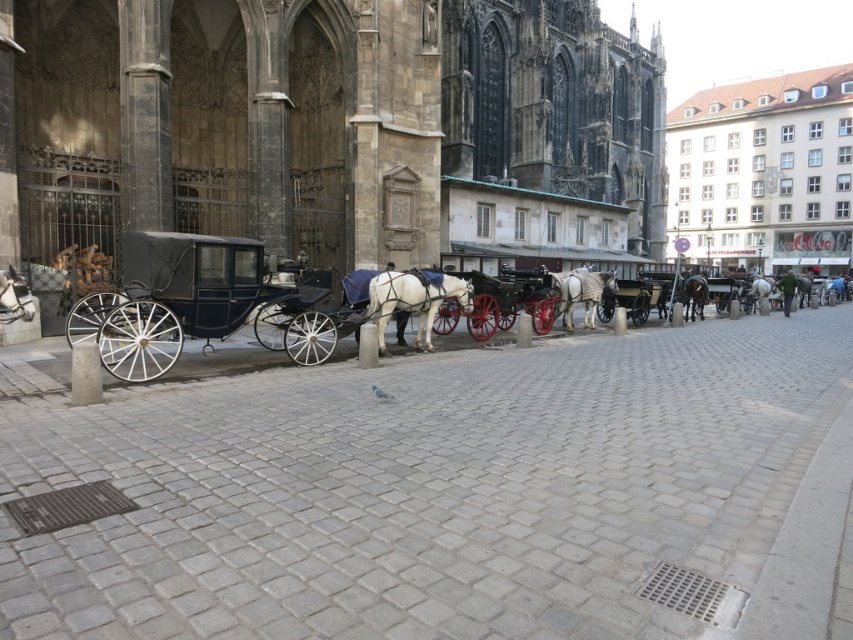
You are a tourist standing on the cobblestone street and see the white matte horse at center and the shiny brown horse at center. Which horse is bigger?

The white matte horse at center is larger in size compared to the shiny brown horse at center.

You are a tourist standing on the cobblestone street and want to take a photo of both the white glossy horse at center and the shiny black coach at center. Which object should you position closer to the left side of your camera frame to include both in the photo?

You should position the white glossy horse at center closer to the left side of your camera frame because it is already to the left of the shiny black coach at center in the scene.

You are a tourist standing on the cobblestone street and want to take a photo of both the shiny black carriage at left and the white glossy cart at center. Which object should you position closer to the left side of your camera frame to include both in the photo?

You should position the shiny black carriage at left closer to the left side of your camera frame since it is already on the left side of the white glossy cart at center.